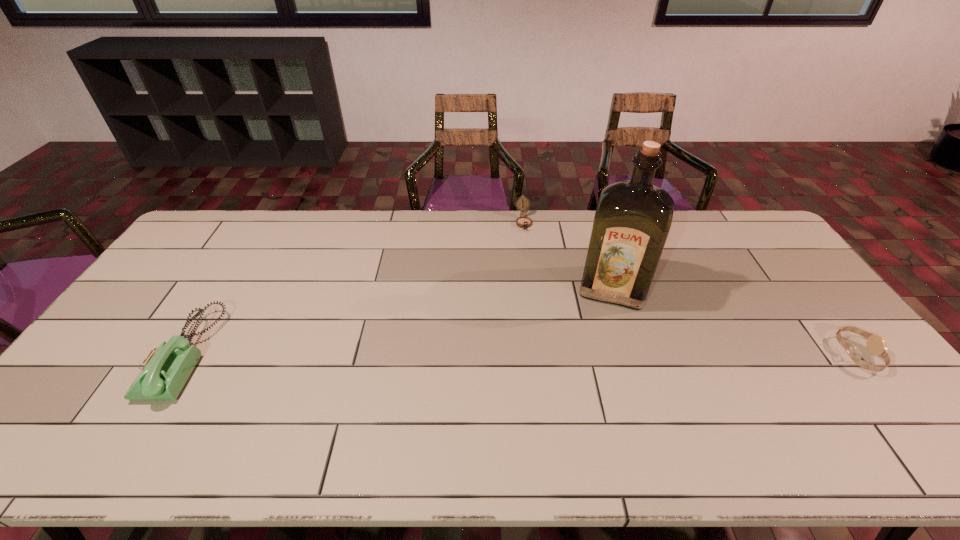
Find the location of a particular element. vacant space located on the dial of the second tallest object is located at coordinates (120, 354).

You are a GUI agent. You are given a task and a screenshot of the screen. Output one action in this format:
    pyautogui.click(x=<x>, y=<y>)
    Task: Click on the free region located 0.090m on the label of the second object from right to left
    The width and height of the screenshot is (960, 540).
    Given the screenshot: What is the action you would take?
    pyautogui.click(x=604, y=332)

I want to click on free space located on the label of the second object from right to left, so click(595, 383).

The image size is (960, 540). Find the location of `vacant space located 0.300m on the label of the second object from right to left`. vacant space located 0.300m on the label of the second object from right to left is located at coordinates (593, 393).

Locate an element on the screen. Image resolution: width=960 pixels, height=540 pixels. free point located on the face of the third tallest object is located at coordinates (533, 281).

The height and width of the screenshot is (540, 960). Identify the location of blank space located on the face of the third tallest object. (538, 306).

Locate an element on the screen. This screenshot has width=960, height=540. vacant area situated 0.120m on the face of the third tallest object is located at coordinates (528, 254).

You are a GUI agent. You are given a task and a screenshot of the screen. Output one action in this format:
    pyautogui.click(x=<x>, y=<y>)
    Task: Click on the object present at the far edge
    
    Given the screenshot: What is the action you would take?
    pyautogui.click(x=524, y=222)

Where is `object that is at the near edge`? object that is at the near edge is located at coordinates (164, 372).

Locate an element on the screen. object present at the right edge is located at coordinates (876, 345).